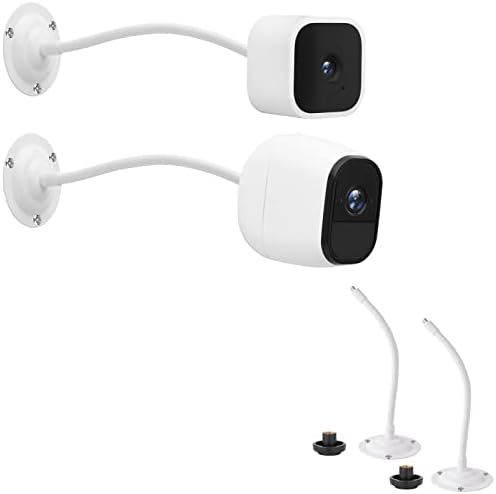
Image resolution: width=496 pixels, height=494 pixels. Identify the location of mount arm. (81, 171), (86, 40), (471, 386), (394, 371).